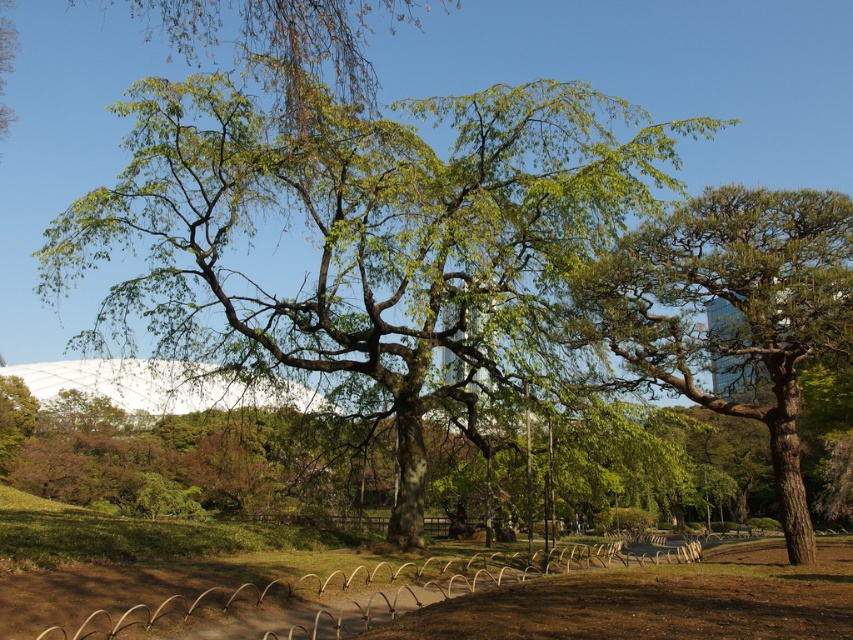
In the scene shown: You are standing at the entrance of the park and see the green leafy oak tree at center and the green textured tree at right. Which tree is positioned more to the left side of the park?

The green leafy oak tree at center is positioned more to the left side of the park compared to the green textured tree at right.

You are standing at the entrance of the park and see the green leafy oak tree at center. If you want to walk directly towards it, which direction should you move relative to your current position?

Since the green leafy oak tree at center is located at coordinates approximately 0.375 along the horizontal axis and 0.428 along the vertical axis, you should move towards the center of the image to reach it directly.

You are planning to place a picnic blanket in the park. The green leafy oak tree at center and the green textured tree at right are both potential spots. Based on their sizes, which tree would provide more shade coverage for your blanket?

The green leafy oak tree at center might provide more shade coverage than the green textured tree at right since it is wider according to the description.